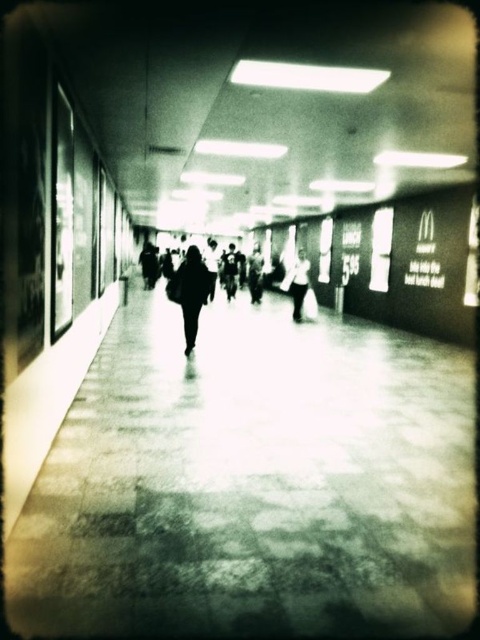
Question: Can you confirm if dark fabric jacket at center is positioned below white cotton shirt at center?

Choices:
 (A) yes
 (B) no

Answer: (B)

Question: Is dark fabric jacket at center bigger than white cotton shirt at center?

Choices:
 (A) no
 (B) yes

Answer: (B)

Question: Among these objects, which one is nearest to the camera?

Choices:
 (A) dark fabric jacket at center
 (B) white cotton shirt at center

Answer: (A)

Question: Which point appears farthest from the camera in this image?

Choices:
 (A) (186, 273)
 (B) (291, 294)

Answer: (B)

Question: Can you confirm if dark fabric jacket at center is thinner than white cotton shirt at center?

Choices:
 (A) no
 (B) yes

Answer: (A)